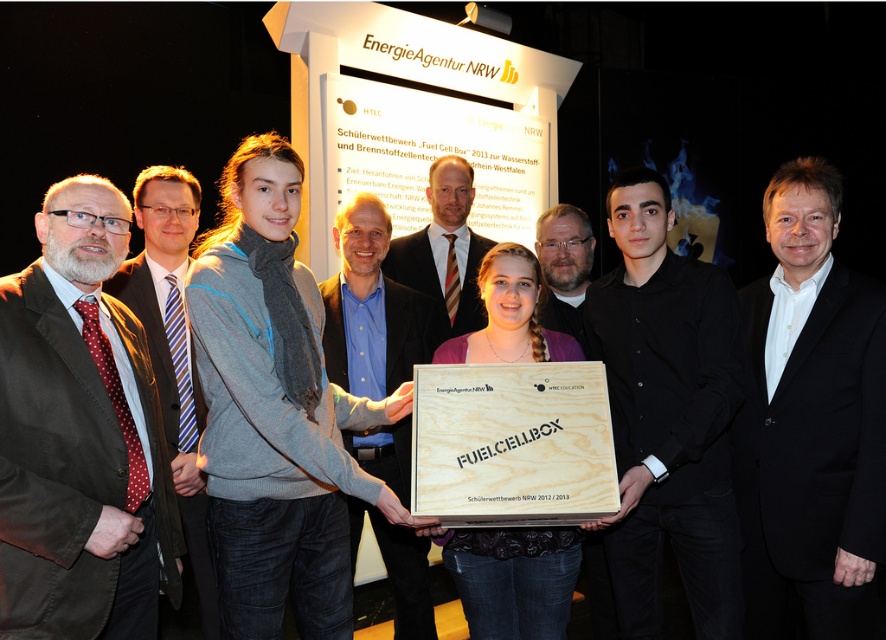
You are an event organizer at the formal gathering. You need to place a new award plaque on the table. The plaque is 15 cm wide. Which object, the black wood box at center or the wooden fuelcellbox at center, should you place it on to ensure it fits properly?

The black wood box at center has a larger size compared to wooden fuelcellbox at center, so the plaque will fit better on the black wood box at center.

You are an event photographer at the formal event. You need to capture a photo that includes both the dark brown suit at left and the wooden at center. Which object should you focus on first to ensure both are in frame?

The dark brown suit at left is larger in size than the wooden at center, so you should focus on the dark brown suit at left first to ensure both are in frame.

What is the spatial relationship between the dark brown suit at left and the wooden at center?

The dark brown suit at left is in front of the wooden at center.